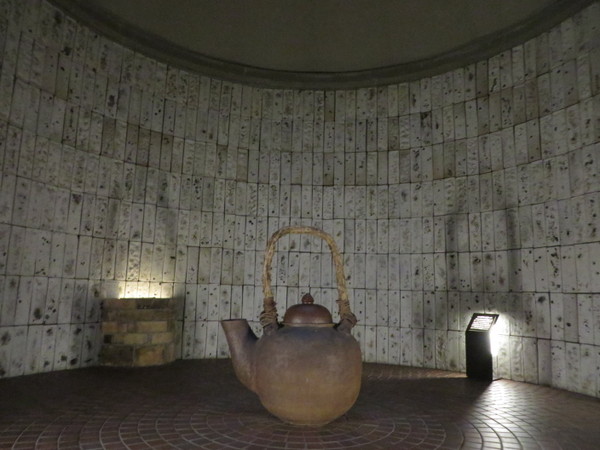
The height and width of the screenshot is (450, 600). What are the coordinates of `kettle tea` in the screenshot? It's located at (309, 369).